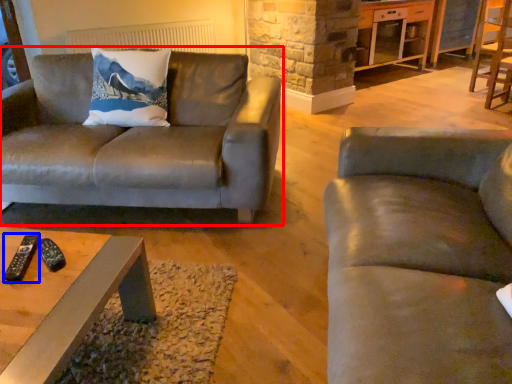
Question: Which object appears farthest to the camera in this image, studio couch (highlighted by a red box) or remote (highlighted by a blue box)?

Choices:
 (A) studio couch
 (B) remote

Answer: (A)